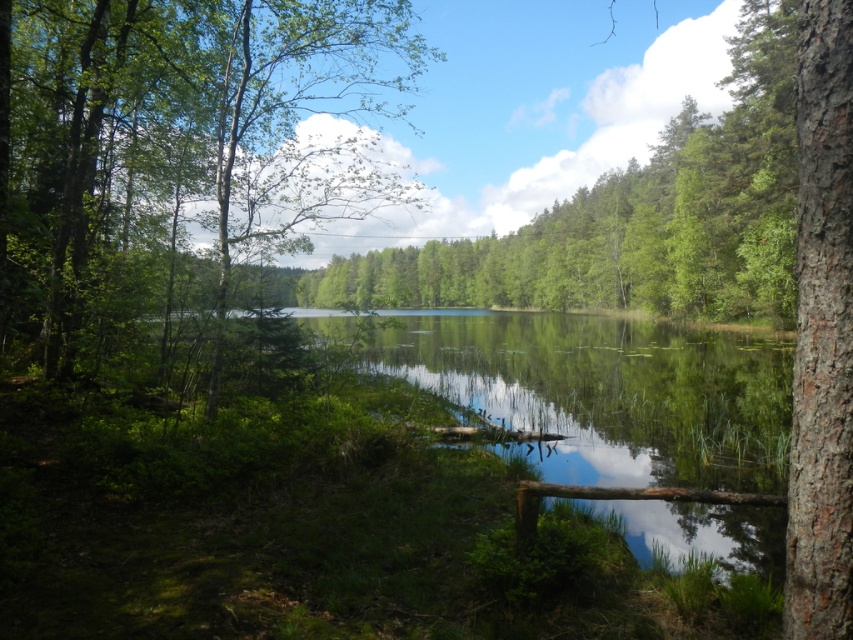
Which of these two, green leafy tree at left or green leafy tree at center, stands taller?

green leafy tree at left is taller.

Is green leafy tree at left to the right of green leafy tree at center from the viewer's perspective?

No, green leafy tree at left is not to the right of green leafy tree at center.

You are a GUI agent. You are given a task and a screenshot of the screen. Output one action in this format:
    pyautogui.click(x=<x>, y=<y>)
    Task: Click on the green leafy tree at left
    This screenshot has width=853, height=640.
    Given the screenshot: What is the action you would take?
    [180, 150]

Is green leafy tree at left bigger than green reflective water at center?

Correct, green leafy tree at left is larger in size than green reflective water at center.

Does point (3, 259) lie behind point (320, 314)?

No.

Is point (13, 141) closer to camera compared to point (728, 440)?

No, (13, 141) is further to viewer.

I want to click on green leafy tree at left, so click(180, 150).

Is green reflective water at center thinner than green leafy tree at center?

Correct, green reflective water at center's width is less than green leafy tree at center's.

Measure the distance between green reflective water at center and camera.

The distance of green reflective water at center from camera is 19.87 feet.

This screenshot has height=640, width=853. What are the coordinates of `green reflective water at center` in the screenshot? It's located at (595, 388).